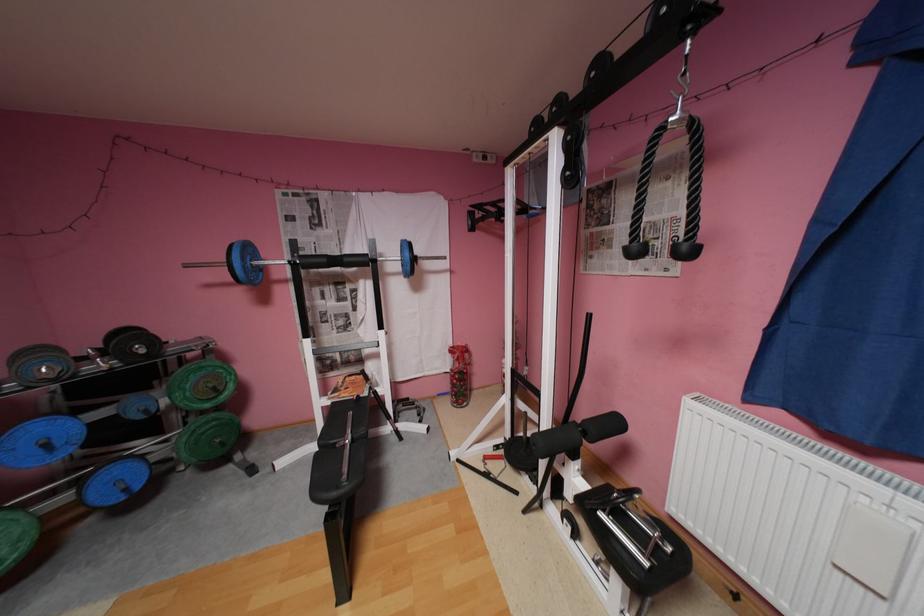
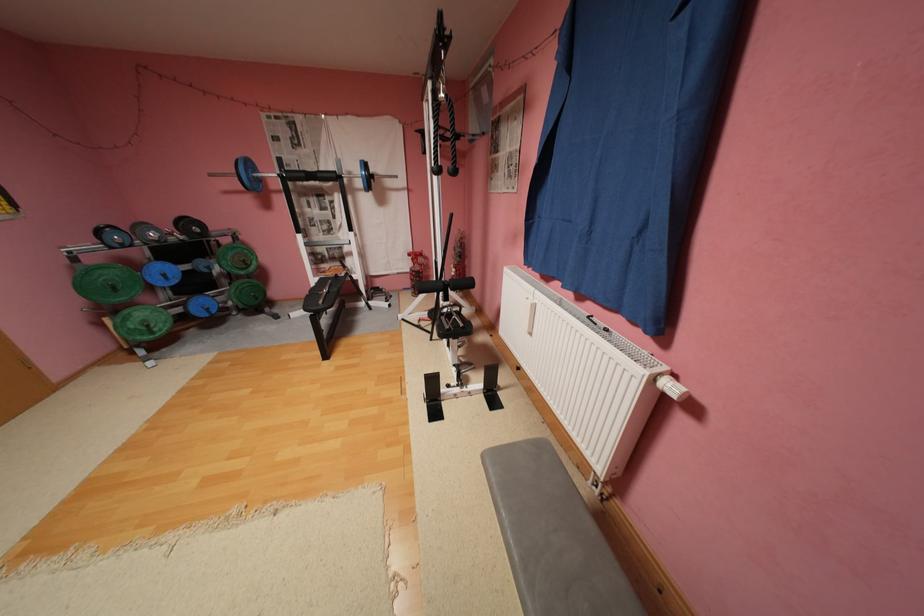
The images are taken continuously from a first-person perspective. In which direction are you moving?

The cameraman moved toward right, backward.